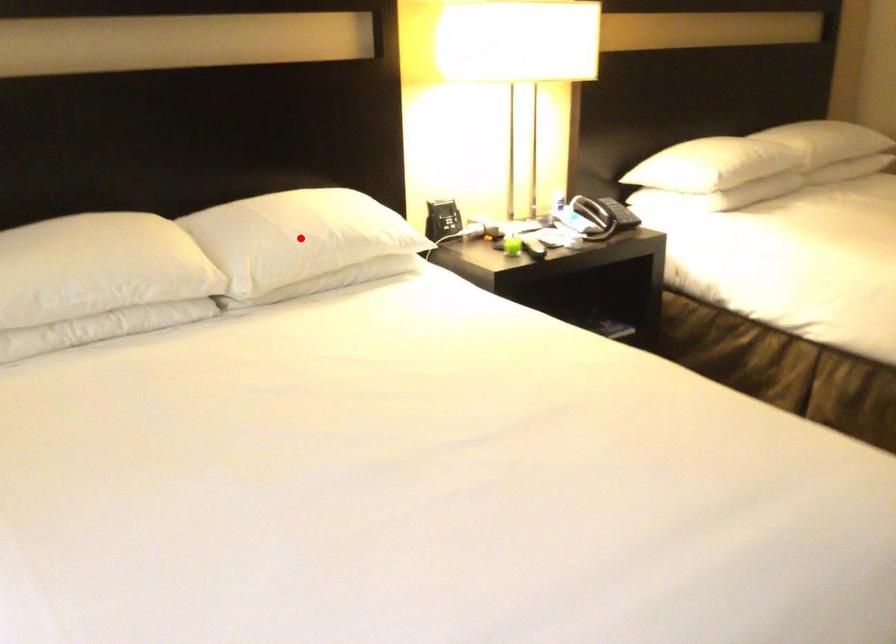
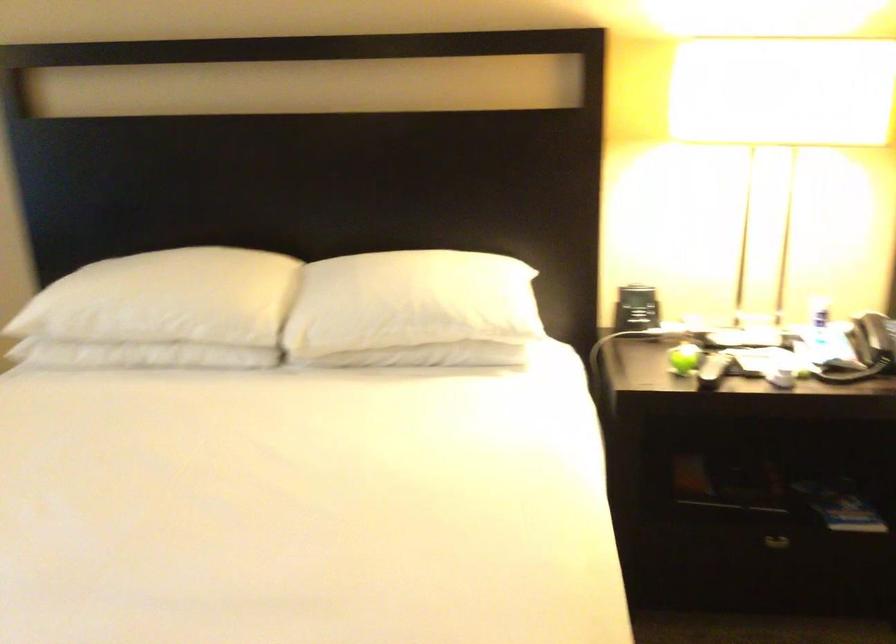
Question: I am providing you with two images of the same scene from different viewpoints. Given a red point in image1, look at the same physical point in image2. Is it:

Choices:
 (A) Closer to the viewpoint
 (B) Farther from the viewpoint

Answer: (A)